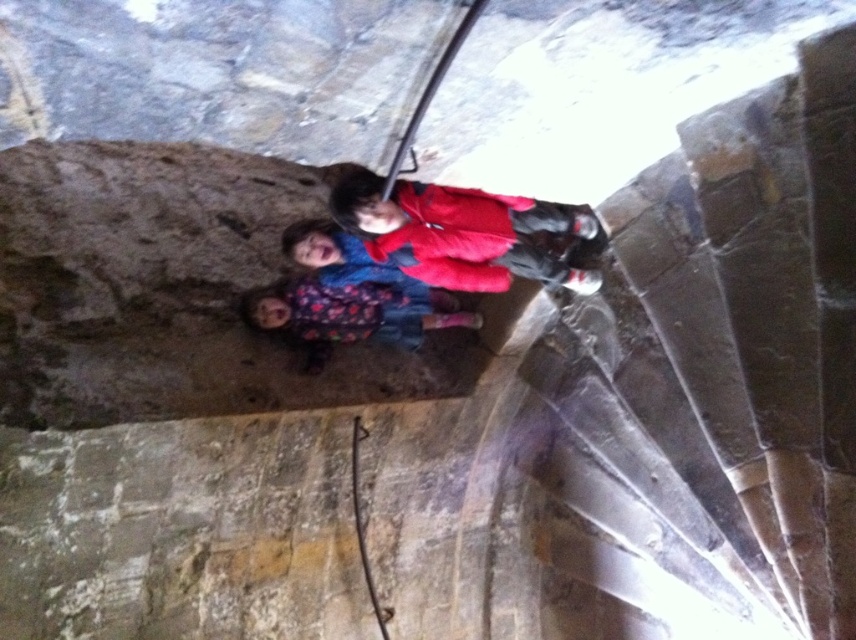
You are a photographer trying to position a tripod in the exact center of the image. The matte red jacket at center is located at coordinates 0.364, 0.539. Is the jacket positioned exactly at the center of the image?

The matte red jacket at center is located at coordinates (461, 232), which is not the exact center of the image. The exact center would be at coordinates (428, 320). Therefore, the jacket is slightly to the left and below the true center.

Looking at this image, you are standing in a historical stone structure with three children. There are two points marked in the image. The first point is at coordinates point [424,282] and the second point is at point [406,320]. Which point is closer to you?

Point [424,282] is in front of point [406,320], so it is closer to you.